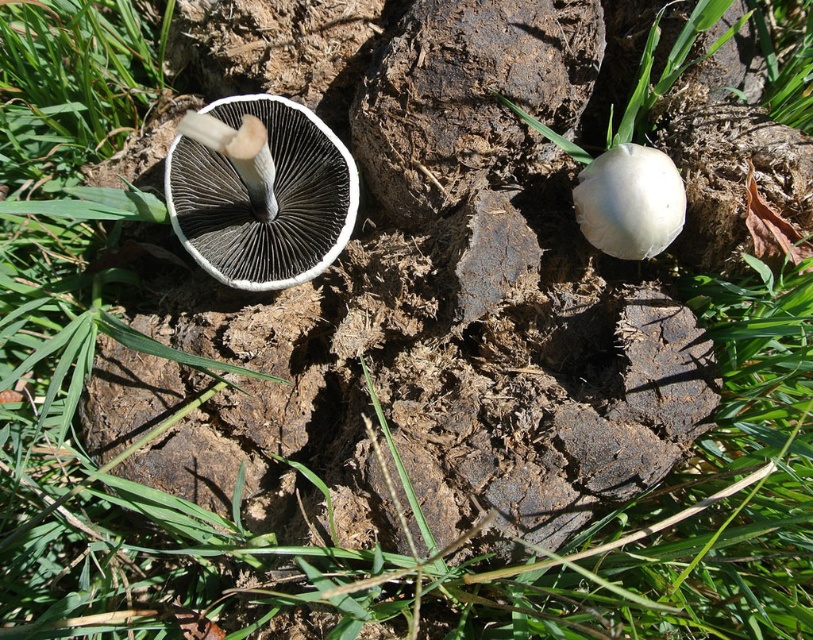
Does white matte mushroom at center have a smaller size compared to white matte mushroom at right?

No, white matte mushroom at center is not smaller than white matte mushroom at right.

Is white matte mushroom at center bigger than white matte mushroom at right?

Yes, white matte mushroom at center is bigger than white matte mushroom at right.

Is point (331, 221) more distant than point (650, 148)?

Yes, point (331, 221) is farther from viewer.

Locate an element on the screen. This screenshot has height=640, width=813. white matte mushroom at center is located at coordinates (259, 192).